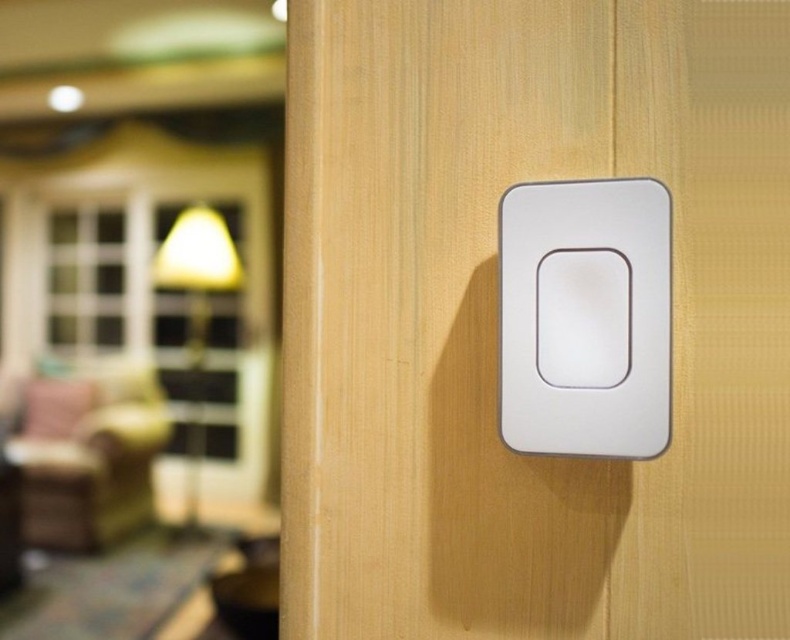
Does white matte switch at center appear under matte yellow lampshade at upper left?

Indeed, white matte switch at center is positioned under matte yellow lampshade at upper left.

Is white matte switch at center to the right of matte yellow lampshade at upper left from the viewer's perspective?

Yes, white matte switch at center is to the right of matte yellow lampshade at upper left.

Locate an element on the screen. The width and height of the screenshot is (790, 640). white matte switch at center is located at coordinates (497, 323).

The width and height of the screenshot is (790, 640). I want to click on white matte switch at center, so click(497, 323).

Who is more forward, (x=578, y=256) or (x=204, y=312)?

Point (x=578, y=256) is in front.

Where is `white glossy light switch at center`? white glossy light switch at center is located at coordinates (585, 317).

The image size is (790, 640). I want to click on white glossy light switch at center, so (x=585, y=317).

Does white matte switch at center have a greater height compared to matte yellow lampshade at left?

Yes.

Is point (395, 474) in front of point (172, 285)?

That is True.

Locate an element on the screen. This screenshot has width=790, height=640. white matte switch at center is located at coordinates (497, 323).